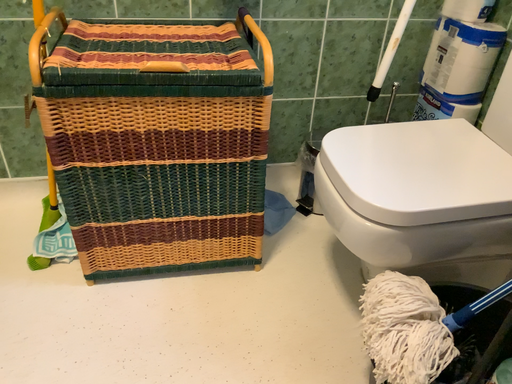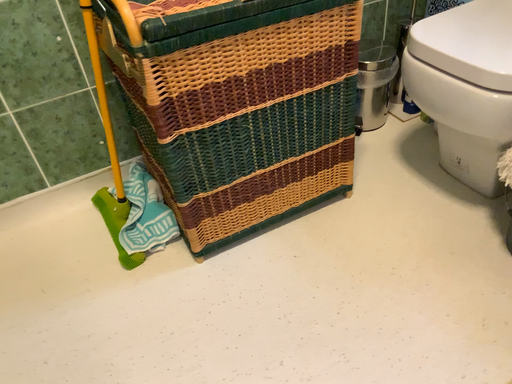
Question: How did the camera likely rotate when shooting the video?

Choices:
 (A) rotated left
 (B) rotated right

Answer: (B)